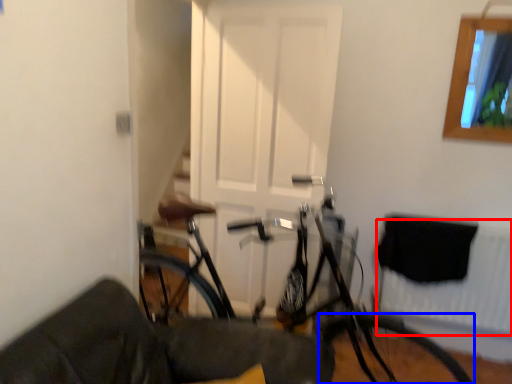
Question: Which of the following is the closest to the observer, radiator (highlighted by a red box) or bicycle wheel (highlighted by a blue box)?

Choices:
 (A) radiator
 (B) bicycle wheel

Answer: (B)